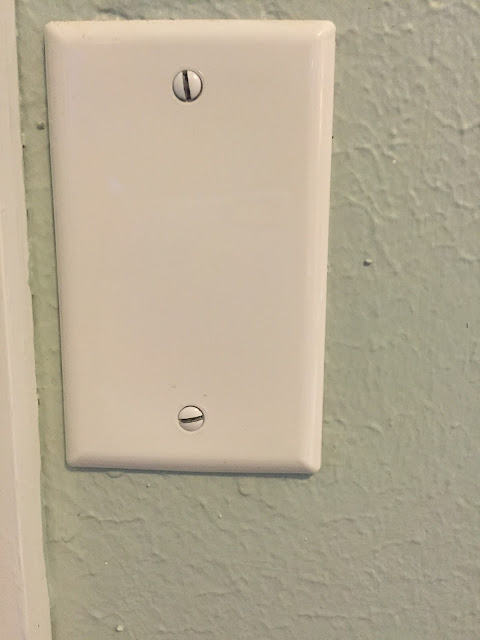
Where is `light switch not in image`? The image size is (480, 640). light switch not in image is located at coordinates (176, 230).